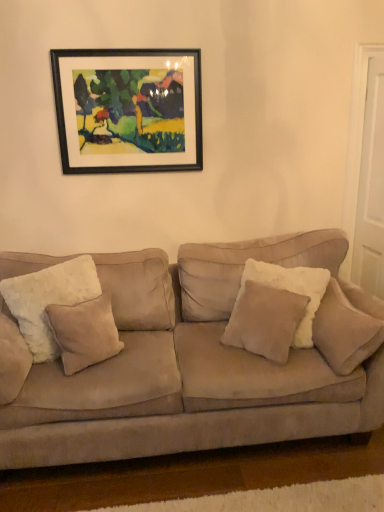
In order to face beige suede pillow at right, the 4th pillow from the left, should I rotate leftwards or rightwards?

A 18.505 degree turn to the right will do.

Image resolution: width=384 pixels, height=512 pixels. Describe the element at coordinates (191, 367) in the screenshot. I see `beige suede couch at center` at that location.

Where is `beige suede couch at center`? The height and width of the screenshot is (512, 384). beige suede couch at center is located at coordinates (191, 367).

At what (x,y) coordinates should I click in order to perform the action: click on white fluffy pillow at left, placed as the 1th pillow when sorted from left to right. Please return your answer as a coordinate pair (x, y). This screenshot has height=512, width=384. Looking at the image, I should click on (48, 300).

Is beige suede couch at center not near black wood picture frame at upper center?

Indeed, beige suede couch at center is not near black wood picture frame at upper center.

What's the angular difference between beige suede couch at center and black wood picture frame at upper center's facing directions?

0.538 degrees separate the facing orientations of beige suede couch at center and black wood picture frame at upper center.

Considering the sizes of objects beige suede couch at center and black wood picture frame at upper center in the image provided, who is taller, beige suede couch at center or black wood picture frame at upper center?

beige suede couch at center is taller.

Based on the photo, which of these two, black wood picture frame at upper center or white matte door at right, is wider?

white matte door at right is wider.

Is black wood picture frame at upper center shorter than white matte door at right?

Correct, black wood picture frame at upper center is not as tall as white matte door at right.

Is black wood picture frame at upper center not inside white matte door at right?

Indeed, black wood picture frame at upper center is completely outside white matte door at right.

In the scene shown: From the image's perspective, which object appears higher, black wood picture frame at upper center or white matte door at right?

Result: black wood picture frame at upper center is shown above in the image.

Between black wood picture frame at upper center and beige suede pillow at left, placed as the 3th pillow when sorted from right to left, which one is positioned in front?

Positioned in front is beige suede pillow at left, placed as the 3th pillow when sorted from right to left.

Looking at the image, does black wood picture frame at upper center seem bigger or smaller compared to beige suede pillow at left, which appears as the second pillow when viewed from the left?

Clearly, black wood picture frame at upper center is smaller in size than beige suede pillow at left, which appears as the second pillow when viewed from the left.

Is black wood picture frame at upper center thinner than beige suede pillow at left, which appears as the second pillow when viewed from the left?

Yes, black wood picture frame at upper center is thinner than beige suede pillow at left, which appears as the second pillow when viewed from the left.

Are black wood picture frame at upper center and beige suede pillow at left, placed as the 3th pillow when sorted from right to left, located far from each other?

black wood picture frame at upper center is positioned a significant distance from beige suede pillow at left, placed as the 3th pillow when sorted from right to left.

Considering the sizes of objects beige suede pillow at center, the second pillow when ordered from right to left, and beige suede pillow at left, placed as the 3th pillow when sorted from right to left, in the image provided, who is smaller, beige suede pillow at center, the second pillow when ordered from right to left, or beige suede pillow at left, placed as the 3th pillow when sorted from right to left,?

beige suede pillow at left, placed as the 3th pillow when sorted from right to left, is smaller.

Can you confirm if beige suede pillow at center, the second pillow when ordered from right to left, is positioned to the left of beige suede pillow at left, which appears as the second pillow when viewed from the left?

No, beige suede pillow at center, the second pillow when ordered from right to left, is not to the left of beige suede pillow at left, which appears as the second pillow when viewed from the left.

Does point (254, 291) lie behind point (57, 311)?

Yes, it is behind point (57, 311).

Is beige suede pillow at right, the 4th pillow from the left, wider or thinner than beige suede couch at center?

Clearly, beige suede pillow at right, the 4th pillow from the left, has less width compared to beige suede couch at center.

This screenshot has width=384, height=512. I want to click on studio couch that appears below the beige suede pillow at right, the 4th pillow from the left (from a real-world perspective), so click(x=191, y=367).

Considering the relative positions of beige suede pillow at right, positioned as the 1th pillow in right-to-left order, and beige suede couch at center in the image provided, is beige suede pillow at right, positioned as the 1th pillow in right-to-left order, behind beige suede couch at center?

Yes, it is behind beige suede couch at center.

Between white matte door at right and black wood picture frame at upper center, which one has larger width?

white matte door at right.

From a real-world perspective, is white matte door at right positioned above or below black wood picture frame at upper center?

white matte door at right is below black wood picture frame at upper center.

Considering the sizes of white matte door at right and black wood picture frame at upper center in the image, is white matte door at right bigger or smaller than black wood picture frame at upper center?

In the image, white matte door at right appears to be larger than black wood picture frame at upper center.

Is the depth of white fluffy pillow at left, placed as the 1th pillow when sorted from left to right, less than that of beige suede couch at center?

Result: No.

Is beige suede couch at center completely or partially inside white fluffy pillow at left, positioned as the fourth pillow in right-to-left order?

No, beige suede couch at center is not inside white fluffy pillow at left, positioned as the fourth pillow in right-to-left order.

Considering the sizes of objects white fluffy pillow at left, positioned as the fourth pillow in right-to-left order, and beige suede couch at center in the image provided, who is wider, white fluffy pillow at left, positioned as the fourth pillow in right-to-left order, or beige suede couch at center?

beige suede couch at center is wider.

From a real-world perspective, is white fluffy pillow at left, placed as the 1th pillow when sorted from left to right, above or below beige suede couch at center?

white fluffy pillow at left, placed as the 1th pillow when sorted from left to right, is situated higher than beige suede couch at center in the real world.

Where is `studio couch below the black wood picture frame at upper center (from the image's perspective)`? The width and height of the screenshot is (384, 512). studio couch below the black wood picture frame at upper center (from the image's perspective) is located at coordinates (191, 367).

At what (x,y) coordinates should I click in order to perform the action: click on door on the right of black wood picture frame at upper center. Please return your answer as a coordinate pair (x, y). The height and width of the screenshot is (512, 384). Looking at the image, I should click on (366, 170).

Estimate the real-world distances between objects in this image. Which object is further from black wood picture frame at upper center, beige suede couch at center or beige suede pillow at left, placed as the 3th pillow when sorted from right to left?

Among the two, beige suede pillow at left, placed as the 3th pillow when sorted from right to left, is located further to black wood picture frame at upper center.

Looking at the image, which one is located closer to white fluffy pillow at left, positioned as the fourth pillow in right-to-left order, beige suede pillow at center, which is the 3th pillow from left to right, or black wood picture frame at upper center?

The object closer to white fluffy pillow at left, positioned as the fourth pillow in right-to-left order, is beige suede pillow at center, which is the 3th pillow from left to right.

When comparing their distances from beige suede pillow at left, placed as the 3th pillow when sorted from right to left, does black wood picture frame at upper center or beige suede pillow at center, which is the 3th pillow from left to right, seem further?

black wood picture frame at upper center is further to beige suede pillow at left, placed as the 3th pillow when sorted from right to left.

Considering their positions, is beige suede pillow at right, the 4th pillow from the left, positioned further to black wood picture frame at upper center than white matte door at right?

Based on the image, beige suede pillow at right, the 4th pillow from the left, appears to be further to black wood picture frame at upper center.

Estimate the real-world distances between objects in this image. Which object is further from beige suede couch at center, beige suede pillow at left, placed as the 3th pillow when sorted from right to left, or black wood picture frame at upper center?

black wood picture frame at upper center is positioned further to the anchor beige suede couch at center.

From the image, which object appears to be nearer to white fluffy pillow at left, positioned as the fourth pillow in right-to-left order, black wood picture frame at upper center or beige suede couch at center?

beige suede couch at center lies closer to white fluffy pillow at left, positioned as the fourth pillow in right-to-left order, than the other object.

Estimate the real-world distances between objects in this image. Which object is closer to white matte door at right, beige suede pillow at left, which appears as the second pillow when viewed from the left, or black wood picture frame at upper center?

black wood picture frame at upper center is closer to white matte door at right.

Estimate the real-world distances between objects in this image. Which object is further from white fluffy pillow at left, placed as the 1th pillow when sorted from left to right, beige suede pillow at right, the 4th pillow from the left, or black wood picture frame at upper center?

The object further to white fluffy pillow at left, placed as the 1th pillow when sorted from left to right, is beige suede pillow at right, the 4th pillow from the left.

This screenshot has width=384, height=512. What are the coordinates of `studio couch between beige suede pillow at left, which appears as the second pillow when viewed from the left, and beige suede pillow at center, which is the 3th pillow from left to right, in the horizontal direction` in the screenshot? It's located at (191, 367).

The height and width of the screenshot is (512, 384). Identify the location of picture frame between white fluffy pillow at left, positioned as the fourth pillow in right-to-left order, and white matte door at right from left to right. (128, 109).

Identify the location of studio couch located between beige suede pillow at left, placed as the 3th pillow when sorted from right to left, and beige suede pillow at right, the 4th pillow from the left, in the left-right direction. Image resolution: width=384 pixels, height=512 pixels. (191, 367).

The image size is (384, 512). In order to click on studio couch situated between black wood picture frame at upper center and white matte door at right from left to right in this screenshot , I will do `click(191, 367)`.